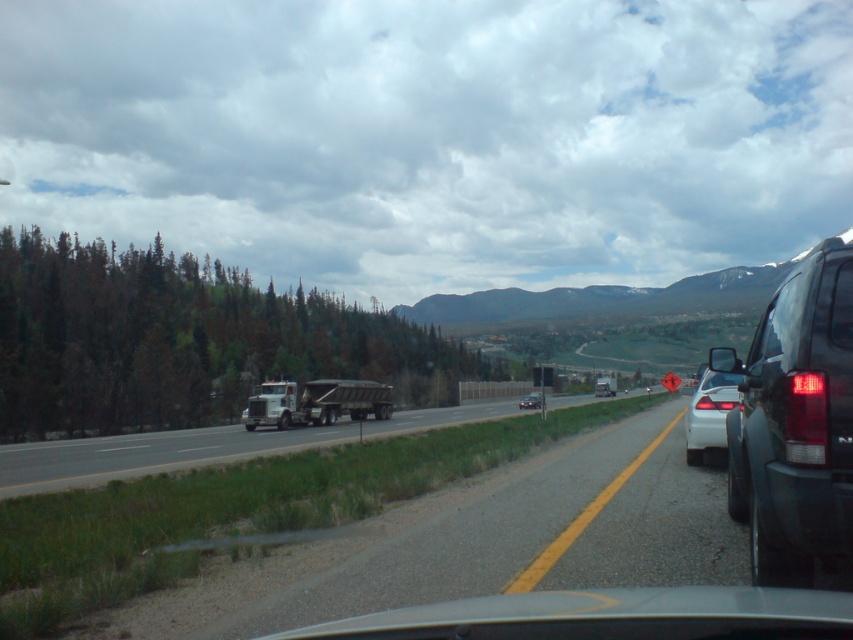
You are a driver approaching the highway and see the black glossy suv at right and the black plastic license plate at right. Which object is closer to the right edge of the road?

The black glossy suv at right is positioned on the right side of black plastic license plate at right, so the black glossy suv at right is closer to the right edge of the road.

You are a driver in a car that is 5 meters long. You want to pass through the gap between the black glossy suv at right and the matte black sedan at center. Can your car fit through the gap without needing to move either vehicle?

The gap between the black glossy suv at right and the matte black sedan at center is 71.93 meters. Since your car is only 5 meters long, it can easily fit through the gap without needing to move either vehicle.

You are a driver approaching the highway and see the black glossy suv at right and the matte black sedan at center. Which vehicle is closer to the left side of the road?

The black glossy suv at right is positioned on the left side of matte black sedan at center, so it is closer to the left side of the road.